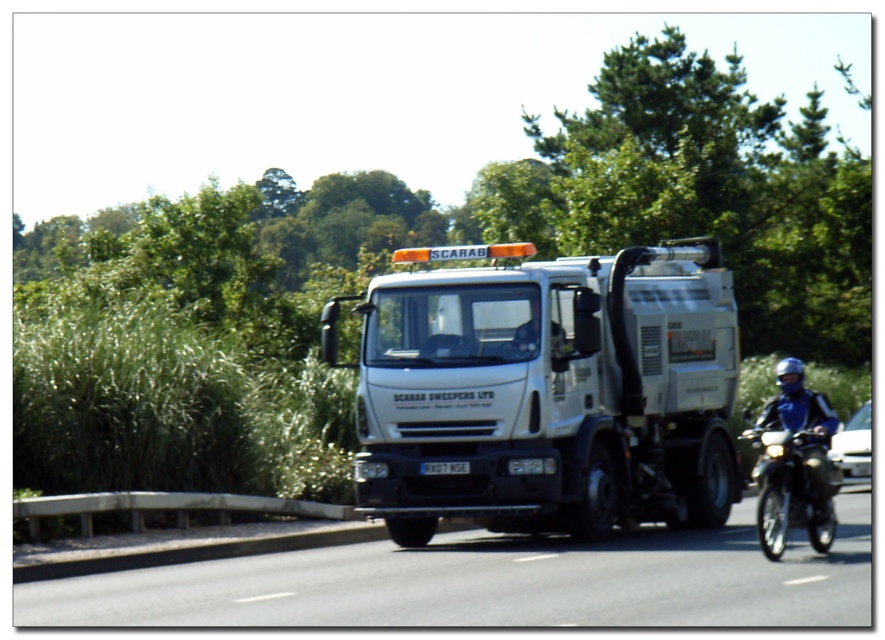
Can you confirm if white matte truck at center is smaller than blue leather jacket at right?

Indeed, white matte truck at center has a smaller size compared to blue leather jacket at right.

Does white matte truck at center have a lesser width compared to blue leather jacket at right?

Incorrect, white matte truck at center's width is not less than blue leather jacket at right's.

Is point (527, 268) in front of point (785, 388)?

No, (527, 268) is further to viewer.

Where is `white matte truck at center`? This screenshot has height=640, width=885. white matte truck at center is located at coordinates (547, 394).

Can you confirm if black asphalt road at center is taller than blue leather jacket at right?

No.

At what (x,y) coordinates should I click in order to perform the action: click on black asphalt road at center. Please return your answer as a coordinate pair (x, y). The width and height of the screenshot is (885, 640). Looking at the image, I should click on (493, 582).

Locate an element on the screen. The image size is (885, 640). black asphalt road at center is located at coordinates (493, 582).

Who is more distant from viewer, (790, 458) or (817, 467)?

The point (817, 467) is more distant.

The image size is (885, 640). What do you see at coordinates (789, 488) in the screenshot?
I see `shiny black motorcycle at right` at bounding box center [789, 488].

Between point (752, 440) and point (791, 364), which one is positioned behind?

The point (791, 364) is more distant.

At what (x,y) coordinates should I click in order to perform the action: click on shiny black motorcycle at right. Please return your answer as a coordinate pair (x, y). The image size is (885, 640). Looking at the image, I should click on (789, 488).